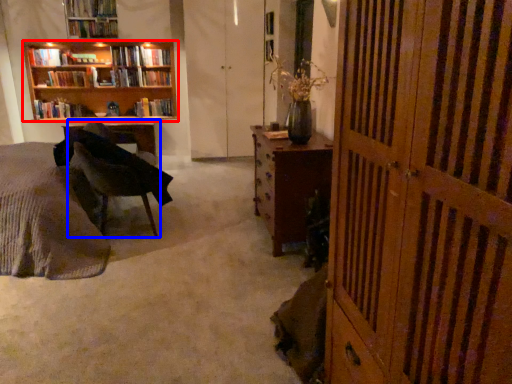
Question: Which point is closer to the camera, bookcase (highlighted by a red box) or chair (highlighted by a blue box)?

Choices:
 (A) bookcase
 (B) chair

Answer: (B)